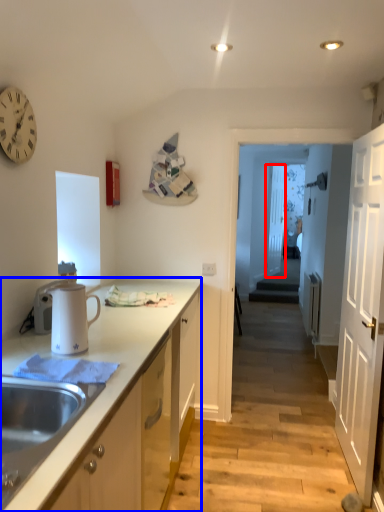
Question: Which object appears closest to the camera in this image, glass door (highlighted by a red box) or cabinetry (highlighted by a blue box)?

Choices:
 (A) glass door
 (B) cabinetry

Answer: (B)